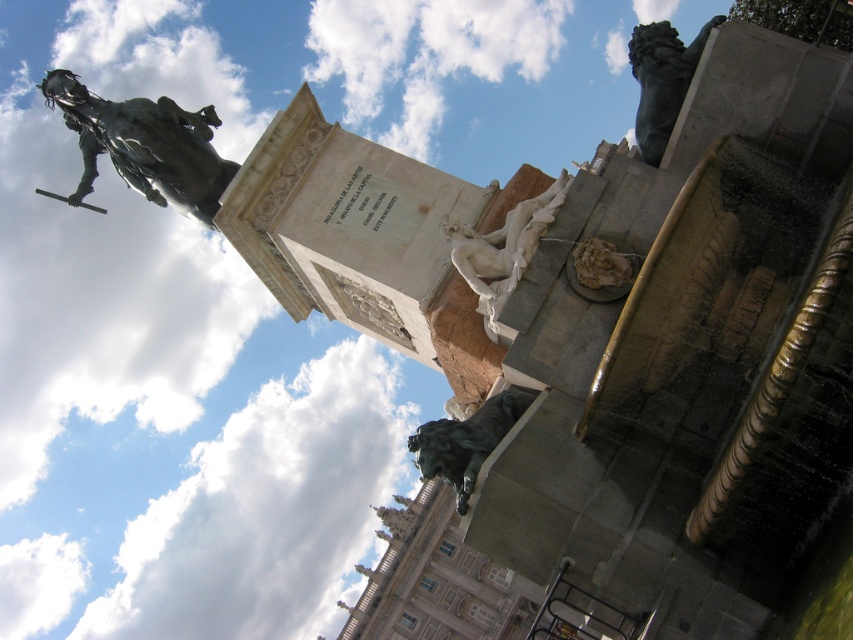
Is bronze lion at upper right closer to the viewer compared to bronze statue at lower right?

No.

Does bronze lion at upper right appear under bronze statue at lower right?

Actually, bronze lion at upper right is above bronze statue at lower right.

Describe the element at coordinates (660, 81) in the screenshot. I see `bronze lion at upper right` at that location.

Where is `bronze lion at upper right`? bronze lion at upper right is located at coordinates (660, 81).

Between point (167, 131) and point (657, 116), which one is positioned behind?

Point (167, 131)

Does bronze statue at upper left appear over bronze lion at upper right?

Actually, bronze statue at upper left is below bronze lion at upper right.

What are the coordinates of `bronze statue at upper left` in the screenshot? It's located at (144, 145).

Is bronze statue at lower right positioned before white marble statue at center?

Yes, bronze statue at lower right is in front of white marble statue at center.

Does point (500, 435) come farther from viewer compared to point (456, 246)?

No.

Identify the location of bronze statue at lower right. The height and width of the screenshot is (640, 853). (466, 440).